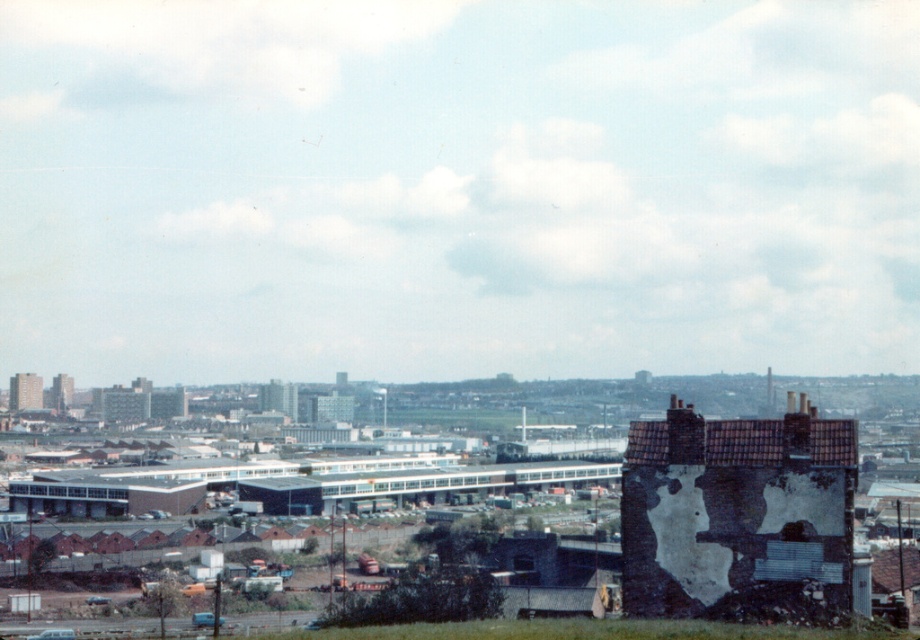
Is white plastered wall at center shorter than brick tower at upper left?

Yes, white plastered wall at center is shorter than brick tower at upper left.

Is the position of white plastered wall at center more distant than that of brick tower at upper left?

No, it is not.

Image resolution: width=920 pixels, height=640 pixels. What do you see at coordinates (738, 515) in the screenshot? I see `white plastered wall at center` at bounding box center [738, 515].

Locate an element on the screen. Image resolution: width=920 pixels, height=640 pixels. white plastered wall at center is located at coordinates (738, 515).

Can you confirm if brick tower at upper left is smaller than brick building at center?

Correct, brick tower at upper left occupies less space than brick building at center.

Is point (19, 392) behind point (67, 390)?

No, it is in front of (67, 390).

I want to click on brick tower at upper left, so click(x=25, y=392).

Who is lower down, white plastered wall at center or brick building at center?

brick building at center

Find the location of a particular element. white plastered wall at center is located at coordinates (738, 515).

What do you see at coordinates (738, 515) in the screenshot?
I see `white plastered wall at center` at bounding box center [738, 515].

The image size is (920, 640). I want to click on white plastered wall at center, so click(x=738, y=515).